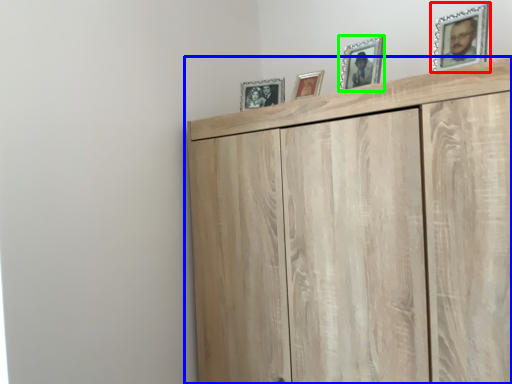
Question: Based on their relative distances, which object is nearer to picture frame (highlighted by a red box)? Choose from cupboard (highlighted by a blue box) and picture frame (highlighted by a green box).

Choices:
 (A) cupboard
 (B) picture frame

Answer: (B)